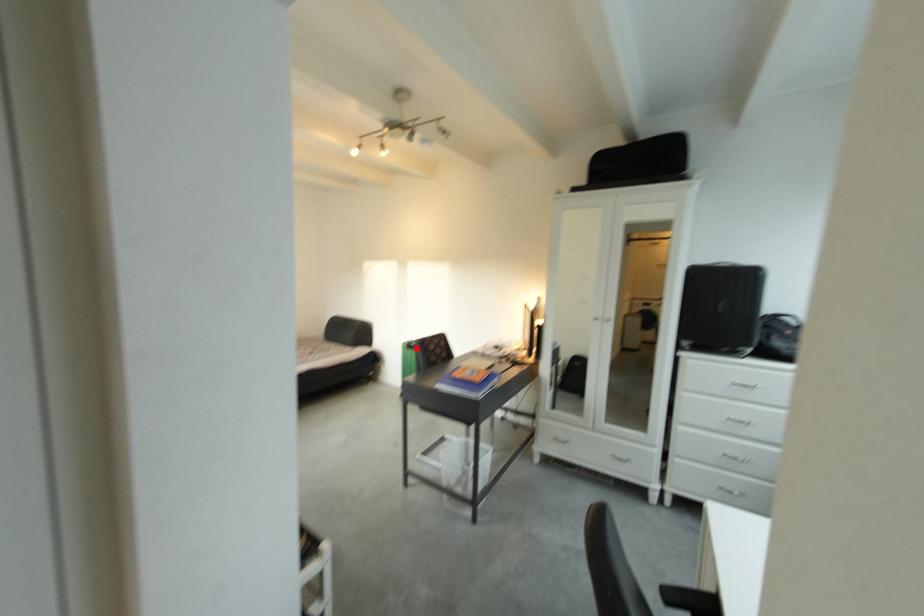
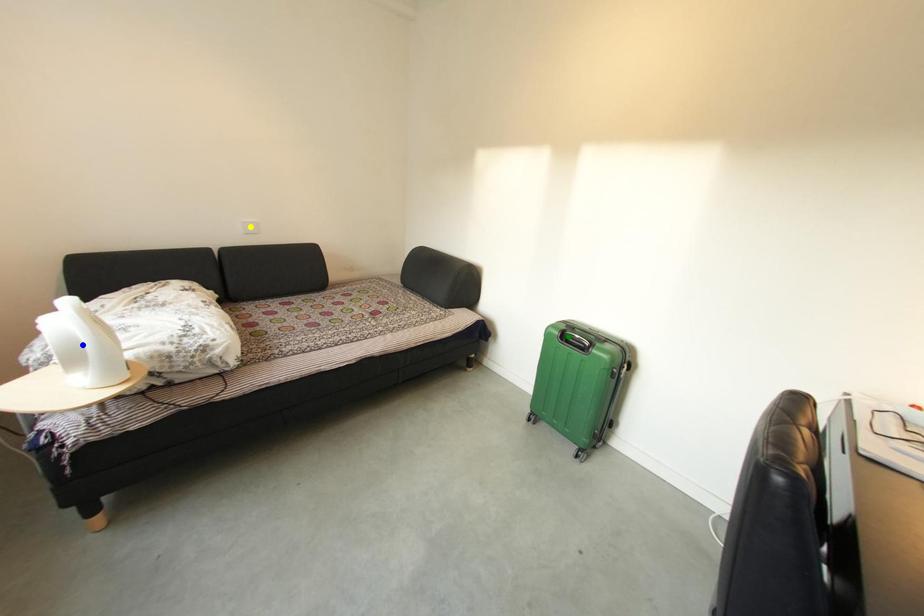
Question: I am providing you with two images of the same scene from different viewpoints. A red point is marked on the first image. You are given multiple points on the second image. Which spot in image 2 lines up with the point in image 1?

Choices:
 (A) green point
 (B) blue point
 (C) yellow point

Answer: (A)